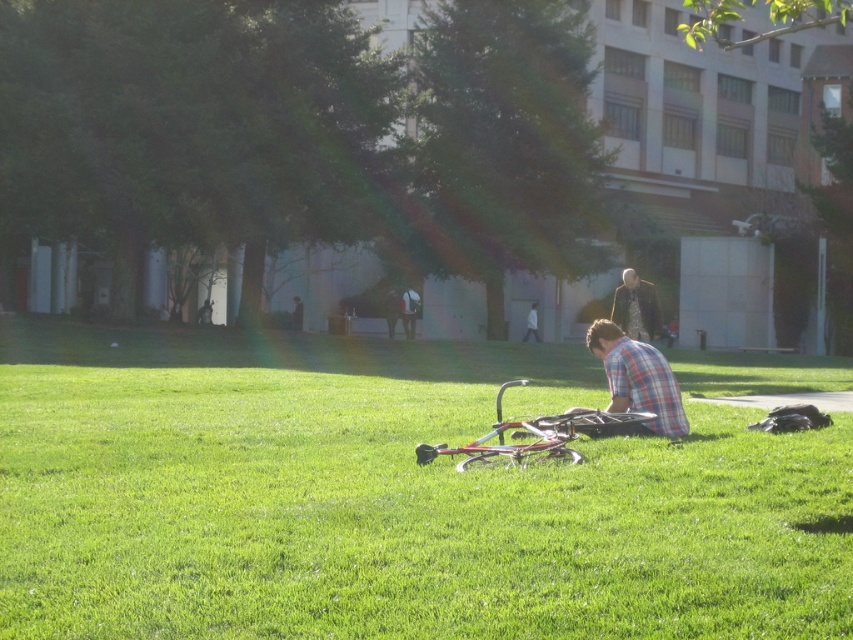
Question: Which of the following is the closest to the observer?

Choices:
 (A) (636, 323)
 (B) (561, 422)

Answer: (B)

Question: Does metallic silver bicycle at center have a lesser width compared to dark brown textured jacket at center?

Choices:
 (A) yes
 (B) no

Answer: (A)

Question: Is metallic silver bicycle at center above plaid fabric shirt at center?

Choices:
 (A) yes
 (B) no

Answer: (B)

Question: Estimate the real-world distances between objects in this image. Which object is farther from the dark brown textured jacket at center?

Choices:
 (A) plaid fabric shirt at center
 (B) metallic silver bicycle at center
 (C) metallic bicycle at center

Answer: (A)

Question: Is metallic bicycle at center wider than plaid fabric shirt at center?

Choices:
 (A) yes
 (B) no

Answer: (A)

Question: Estimate the real-world distances between objects in this image. Which object is farther from the metallic silver bicycle at center?

Choices:
 (A) plaid fabric shirt at center
 (B) dark brown textured jacket at center
 (C) metallic bicycle at center

Answer: (C)